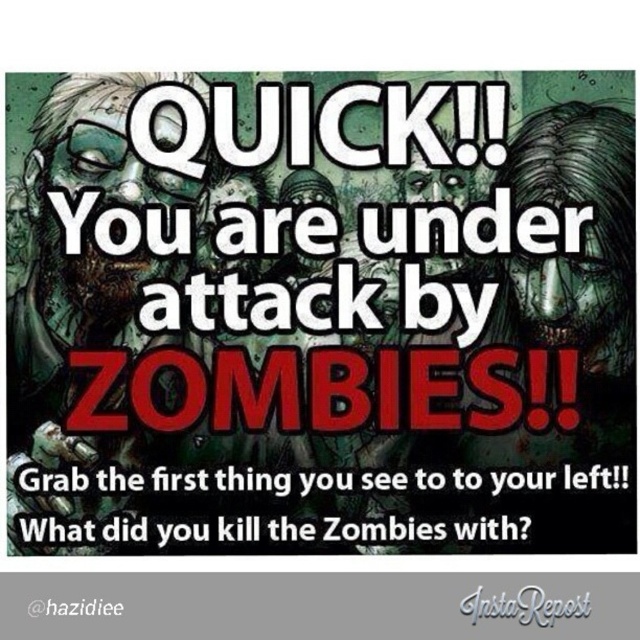
You are in a dark forest and see the graytexturedinstarepost at center and the red text at lower left. Which object is positioned higher up in the image?

The graytexturedinstarepost at center is located above the red text at lower left, so it is positioned higher up in the image.

You are looking at the image and need to quickly identify which object is nearer to you between the graytexturedinstarepost at center and the red text at lower left. Based on the spatial arrangement, which one is closer?

The graytexturedinstarepost at center is closer to the viewer than the red text at lower left.

Looking at this image, you are in a dark forest surrounded by zombies. You see a white paper at center and a red text at lower left. Which item can you reach first if you move straight ahead?

The white paper at center is wider than red text at lower left, so you can reach the white paper at center first since it occupies more space in front of you.